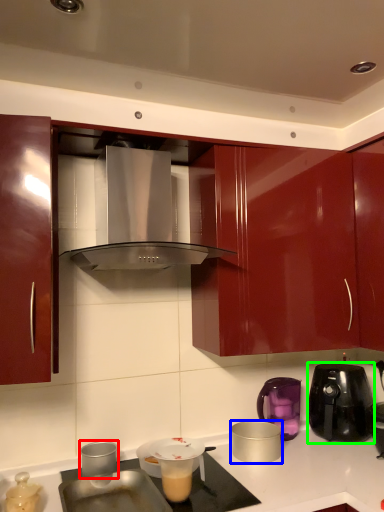
Question: Estimate the real-world distances between objects in this image. Which object is closer to kitchen appliance (highlighted by a red box), kitchen appliance (highlighted by a blue box) or kitchen appliance (highlighted by a green box)?

Choices:
 (A) kitchen appliance
 (B) kitchen appliance

Answer: (A)